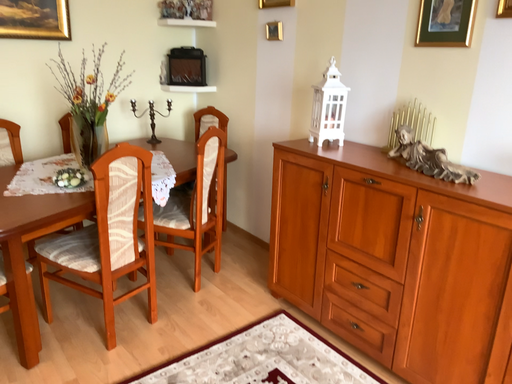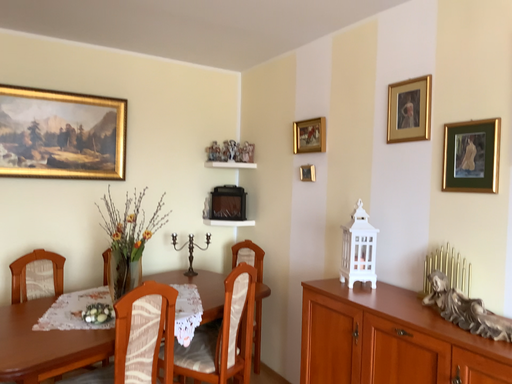
Question: How did the camera likely rotate when shooting the video?

Choices:
 (A) rotated upward
 (B) rotated downward

Answer: (A)